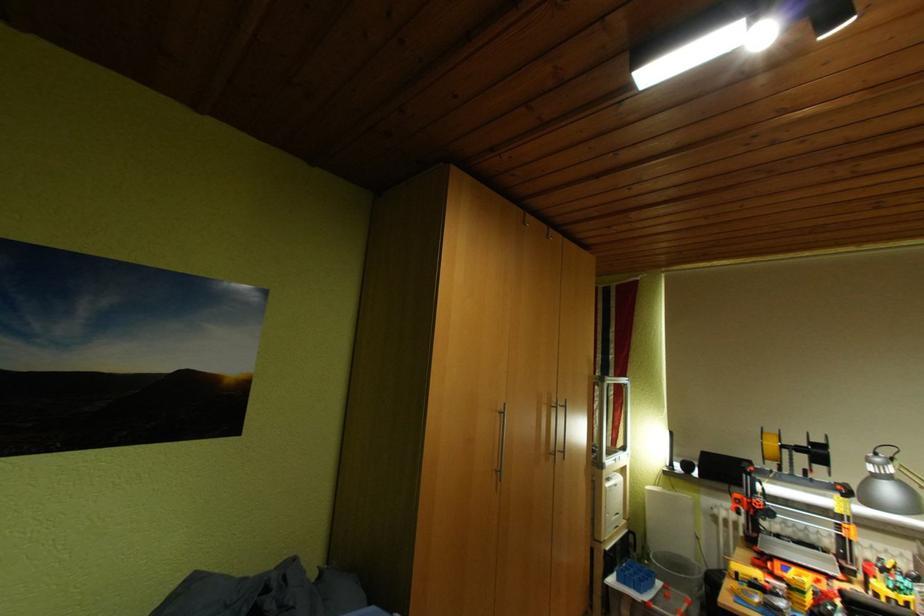
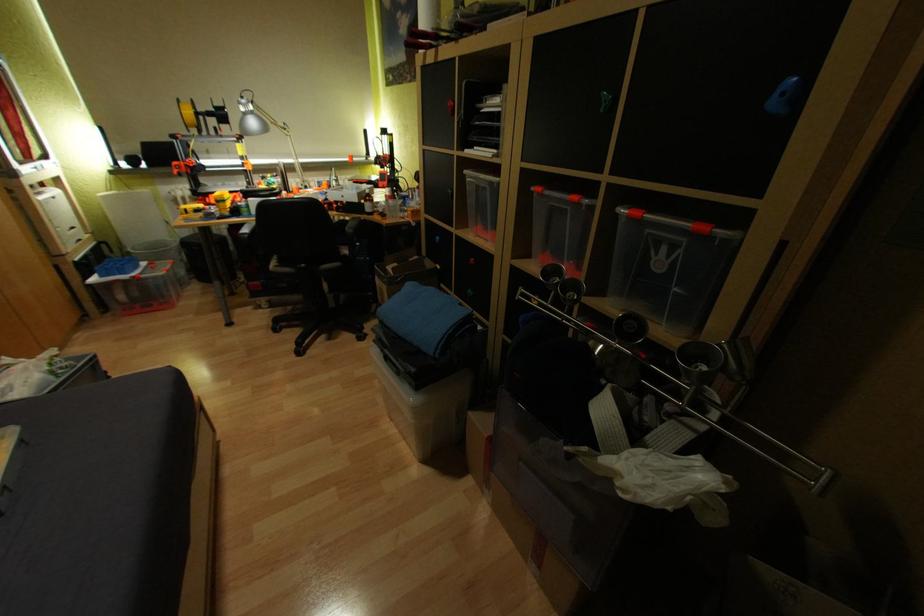
The images are taken continuously from a first-person perspective. In which direction is your viewpoint rotating?

The camera's rotation is toward right-down.